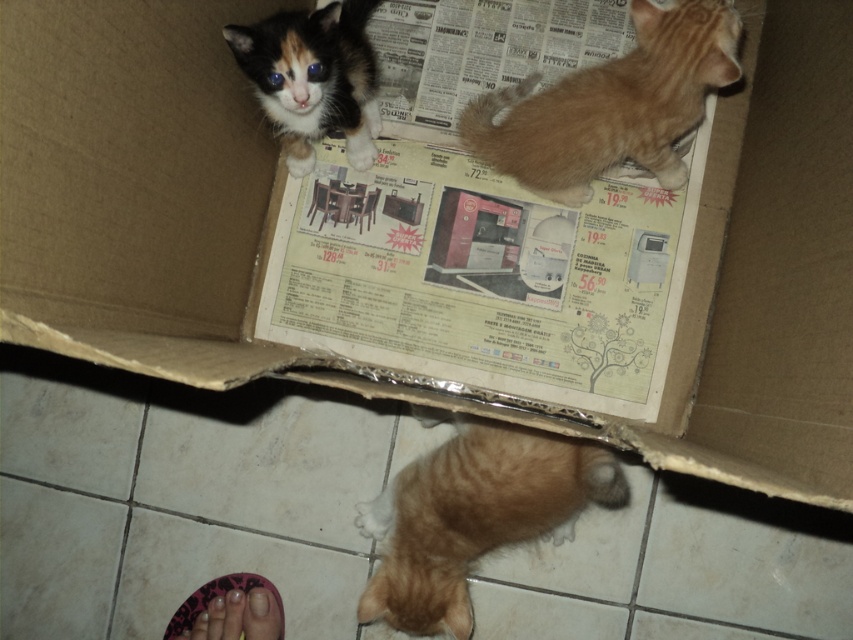
Question: Considering the real-world distances, which object is closest to the calico fur kitten at upper center?

Choices:
 (A) orange fur kitten at upper right
 (B) orange fur cat at lower center

Answer: (A)

Question: Is orange fur kitten at upper right in front of calico fur kitten at upper center?

Choices:
 (A) yes
 (B) no

Answer: (B)

Question: Which object appears closest to the camera in this image?

Choices:
 (A) orange fur cat at lower center
 (B) orange fur kitten at upper right

Answer: (A)

Question: Is orange fur cat at lower center to the right of pink fabric foot at lower left from the viewer's perspective?

Choices:
 (A) no
 (B) yes

Answer: (B)

Question: Which of the following is the farthest from the observer?

Choices:
 (A) orange fur kitten at upper right
 (B) orange fur cat at lower center
 (C) pink fabric foot at lower left
 (D) calico fur kitten at upper center

Answer: (C)

Question: Can you confirm if orange fur kitten at upper right is positioned to the right of calico fur kitten at upper center?

Choices:
 (A) yes
 (B) no

Answer: (A)